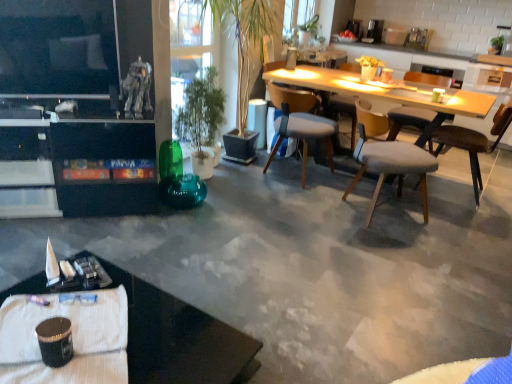
Question: Is light gray fabric chair at center, acting as the 3th chair starting from the right, thinner than light gray fabric chair at center right, which is counted as the second chair, starting from the right?

Choices:
 (A) no
 (B) yes

Answer: (B)

Question: Considering the relative sizes of light gray fabric chair at center, acting as the 3th chair starting from the right, and light gray fabric chair at center right, which is counted as the second chair, starting from the right, in the image provided, is light gray fabric chair at center, acting as the 3th chair starting from the right, wider than light gray fabric chair at center right, which is counted as the second chair, starting from the right,?

Choices:
 (A) no
 (B) yes

Answer: (A)

Question: Is light gray fabric chair at center, acting as the 3th chair starting from the right, positioned in front of light gray fabric chair at center right, marked as the third chair in a left-to-right arrangement?

Choices:
 (A) yes
 (B) no

Answer: (A)

Question: Is the position of light gray fabric chair at center, the 2th chair positioned from the left, more distant than that of light gray fabric chair at center right, marked as the third chair in a left-to-right arrangement?

Choices:
 (A) yes
 (B) no

Answer: (B)

Question: From the image's perspective, is light gray fabric chair at center, acting as the 3th chair starting from the right, located above light gray fabric chair at center right, which is counted as the second chair, starting from the right?

Choices:
 (A) no
 (B) yes

Answer: (A)

Question: From the image's perspective, is light wood table at center located above or below matte white mug at upper center, which is the 2th coffee cup from right to left?

Choices:
 (A) above
 (B) below

Answer: (A)

Question: Is light wood table at center taller or shorter than matte white mug at upper center, positioned as the 3th coffee cup in bottom-to-top order?

Choices:
 (A) tall
 (B) short

Answer: (A)

Question: Is light wood table at center inside or outside of matte white mug at upper center, the 3th coffee cup when ordered from front to back?

Choices:
 (A) inside
 (B) outside

Answer: (B)

Question: Considering the positions of light wood table at center and matte white mug at upper center, positioned as the 3th coffee cup in bottom-to-top order, in the image, is light wood table at center bigger or smaller than matte white mug at upper center, positioned as the 3th coffee cup in bottom-to-top order,?

Choices:
 (A) small
 (B) big

Answer: (B)

Question: Does point (37, 299) appear closer or farther from the camera than point (395, 132)?

Choices:
 (A) farther
 (B) closer

Answer: (B)

Question: Is metallic pen at lower left taller or shorter than light gray fabric chair at center right, marked as the third chair in a left-to-right arrangement?

Choices:
 (A) tall
 (B) short

Answer: (B)

Question: Looking at the image, does metallic pen at lower left seem bigger or smaller compared to light gray fabric chair at center right, marked as the third chair in a left-to-right arrangement?

Choices:
 (A) big
 (B) small

Answer: (B)

Question: From a real-world perspective, is metallic pen at lower left positioned above or below light gray fabric chair at center right, which is counted as the second chair, starting from the right?

Choices:
 (A) above
 (B) below

Answer: (B)

Question: Does point (29, 297) appear closer or farther from the camera than point (262, 1)?

Choices:
 (A) farther
 (B) closer

Answer: (B)

Question: Looking at the image, does metallic pen at lower left seem bigger or smaller compared to green glossy plant at center?

Choices:
 (A) small
 (B) big

Answer: (A)